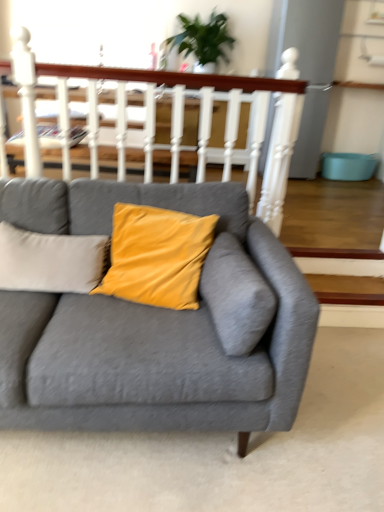
Question: Considering the relative positions of velvet yellow pillow at center and green leafy plant at upper center in the image provided, is velvet yellow pillow at center to the left or to the right of green leafy plant at upper center?

Choices:
 (A) right
 (B) left

Answer: (B)

Question: From a real-world perspective, is velvet yellow pillow at center positioned above or below green leafy plant at upper center?

Choices:
 (A) below
 (B) above

Answer: (A)

Question: Estimate the real-world distances between objects in this image. Which object is farther from the matte gray couch at center?

Choices:
 (A) white wooden balustrade at upper center
 (B) velvet yellow pillow at center
 (C) green leafy plant at upper center

Answer: (C)

Question: Estimate the real-world distances between objects in this image. Which object is closer to the green leafy plant at upper center?

Choices:
 (A) matte gray couch at center
 (B) white wooden balustrade at upper center
 (C) velvet yellow pillow at center

Answer: (B)